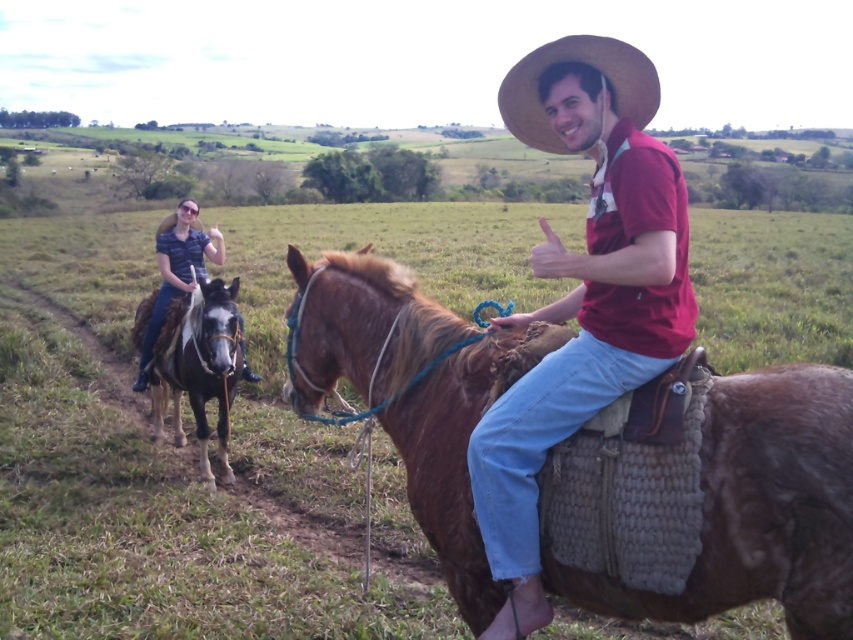
Question: Which of the following is the closest to the observer?

Choices:
 (A) black glossy horse at left
 (B) straw hat at upper right
 (C) matte blue shirt at left

Answer: (B)

Question: Is matte red shirt at center above black glossy horse at left?

Choices:
 (A) no
 (B) yes

Answer: (B)

Question: Does brown leather saddle at center have a larger size compared to straw hat at upper right?

Choices:
 (A) no
 (B) yes

Answer: (A)

Question: Estimate the real-world distances between objects in this image. Which object is closer to the straw hat at upper right?

Choices:
 (A) black glossy horse at left
 (B) matte blue shirt at left

Answer: (A)

Question: Is brown leather saddle at center below black glossy horse at left?

Choices:
 (A) no
 (B) yes

Answer: (A)

Question: Among these points, which one is farthest from the camera?

Choices:
 (A) (552, 42)
 (B) (773, 369)

Answer: (A)